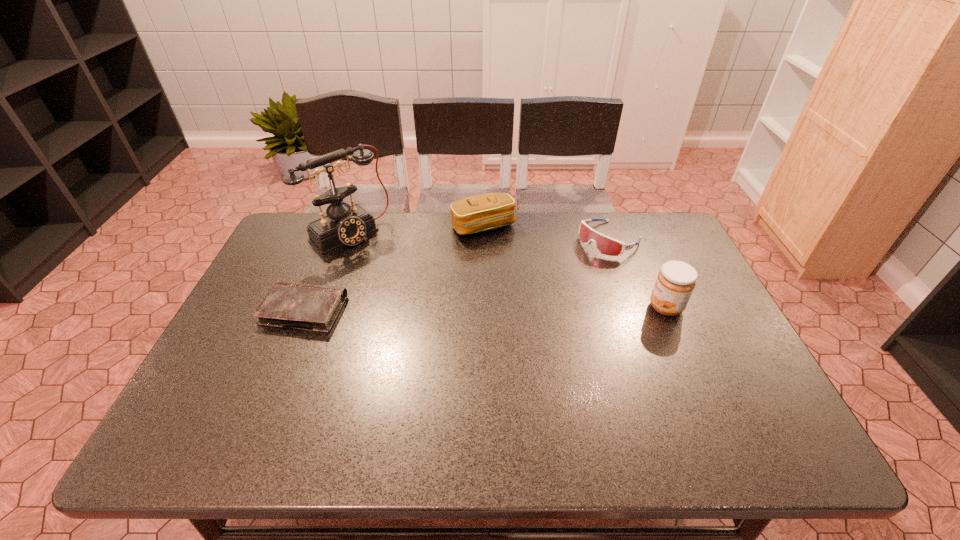
Identify the location of the shortest object. This screenshot has width=960, height=540. (309, 307).

Identify the location of the second tallest object. (676, 280).

Image resolution: width=960 pixels, height=540 pixels. I want to click on goggles, so 605,245.

Identify the location of telephone. (348, 225).

Where is `clutch bag`? The height and width of the screenshot is (540, 960). clutch bag is located at coordinates (483, 212).

This screenshot has height=540, width=960. What are the coordinates of `the third object from right to left` in the screenshot? It's located at (483, 212).

The height and width of the screenshot is (540, 960). Identify the location of free spot located on the front of the shortest object. (265, 406).

The width and height of the screenshot is (960, 540). In order to click on free spot located 0.400m on the front label of the jam in this screenshot , I will do `click(502, 307)`.

At what (x,y) coordinates should I click in order to perform the action: click on free space located 0.270m on the front label of the jam. Please return your answer as a coordinate pair (x, y). The height and width of the screenshot is (540, 960). Looking at the image, I should click on (549, 307).

The width and height of the screenshot is (960, 540). I want to click on vacant area situated 0.350m on the front label of the jam, so click(x=520, y=307).